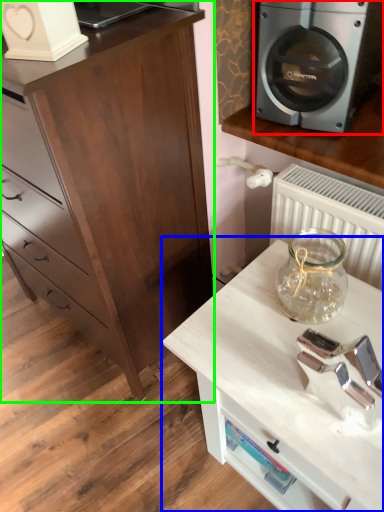
Question: Which is nearer to the home appliance (highlighted by a red box)? table (highlighted by a blue box) or chest of drawers (highlighted by a green box).

Choices:
 (A) table
 (B) chest of drawers

Answer: (B)